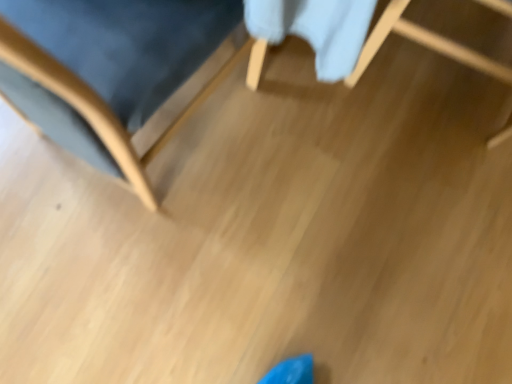
I want to click on velvet blue chair at upper left, so click(x=110, y=70).

The height and width of the screenshot is (384, 512). What do you see at coordinates (110, 70) in the screenshot?
I see `velvet blue chair at upper left` at bounding box center [110, 70].

Where is `velvet blue chair at upper left`? The width and height of the screenshot is (512, 384). velvet blue chair at upper left is located at coordinates (110, 70).